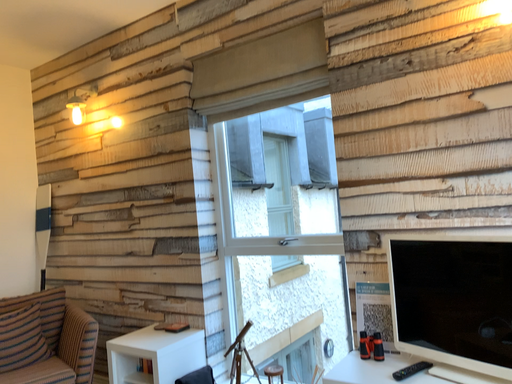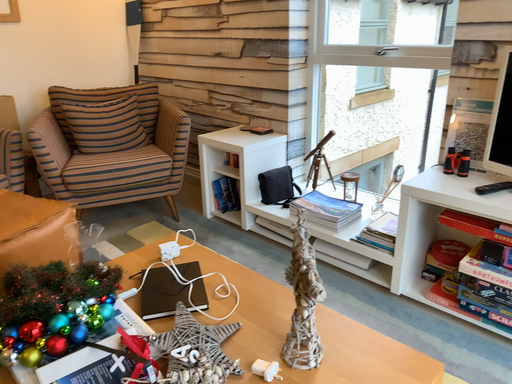
Question: How did the camera likely rotate when shooting the video?

Choices:
 (A) rotated left
 (B) rotated right

Answer: (A)